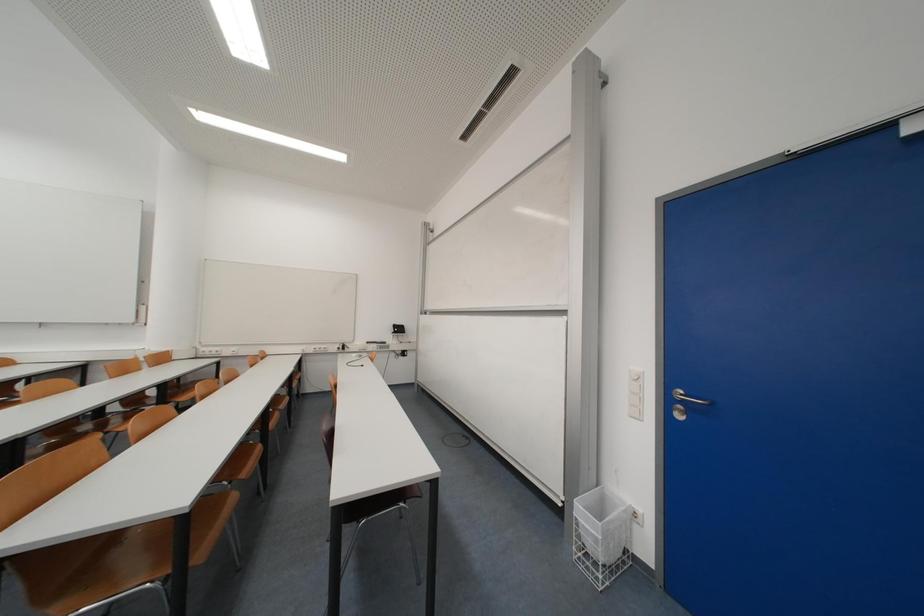
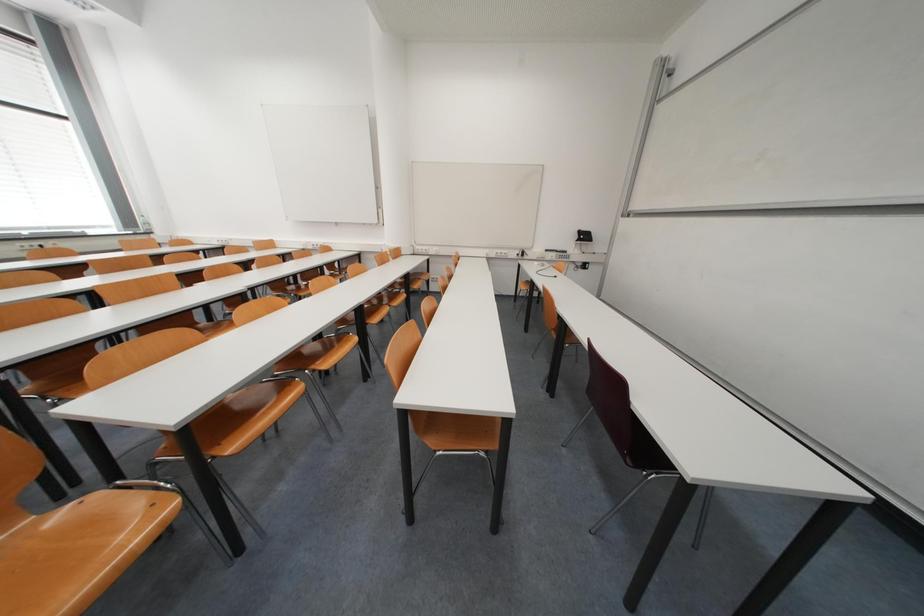
Based on the continuous images, in which direction is the camera rotating?

The camera rotated toward left-down.